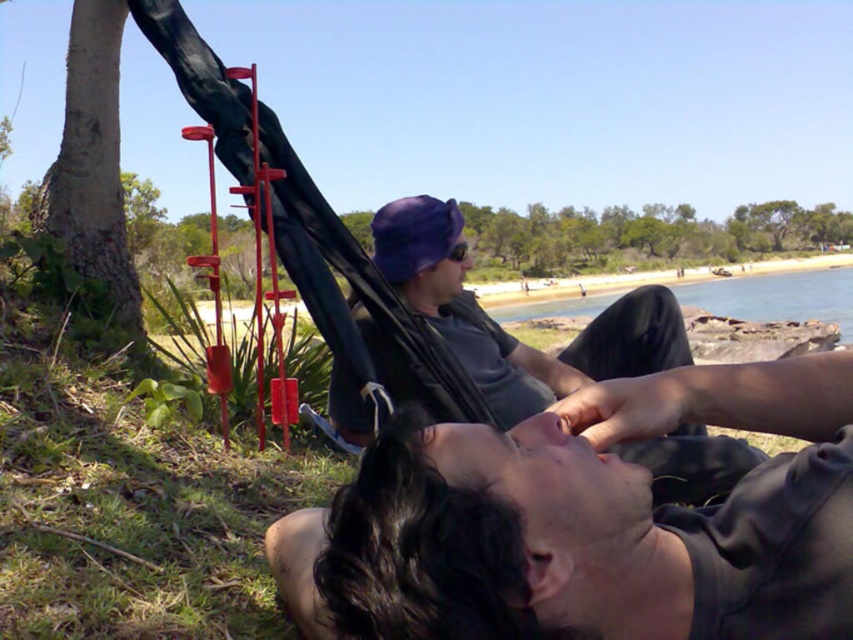
Does dark gray fabric hammock at center have a larger size compared to clear blue water at beach right?

Actually, dark gray fabric hammock at center might be smaller than clear blue water at beach right.

Is dark gray fabric hammock at center below clear blue water at beach right?

Yes, dark gray fabric hammock at center is below clear blue water at beach right.

Where is `dark gray fabric hammock at center`? dark gray fabric hammock at center is located at coordinates (589, 522).

Does matte gray shirt at center come behind clear blue water at beach right?

No, matte gray shirt at center is closer to the viewer.

Can you confirm if matte gray shirt at center is positioned to the left of clear blue water at beach right?

Indeed, matte gray shirt at center is positioned on the left side of clear blue water at beach right.

This screenshot has height=640, width=853. Describe the element at coordinates (503, 330) in the screenshot. I see `matte gray shirt at center` at that location.

Image resolution: width=853 pixels, height=640 pixels. Find the location of `matte gray shirt at center`. matte gray shirt at center is located at coordinates (503, 330).

Is matte gray shirt at center above smooth brown tree trunk at left?

Actually, matte gray shirt at center is below smooth brown tree trunk at left.

Is matte gray shirt at center smaller than smooth brown tree trunk at left?

Incorrect, matte gray shirt at center is not smaller in size than smooth brown tree trunk at left.

Is point (647, 372) closer to viewer compared to point (61, 172)?

Yes, point (647, 372) is closer to viewer.

Where is `matte gray shirt at center`? matte gray shirt at center is located at coordinates (503, 330).